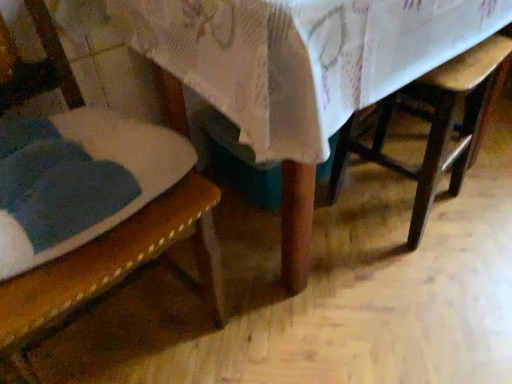
This screenshot has height=384, width=512. I want to click on vacant region to the left of wooden chair at lower right, so click(x=319, y=233).